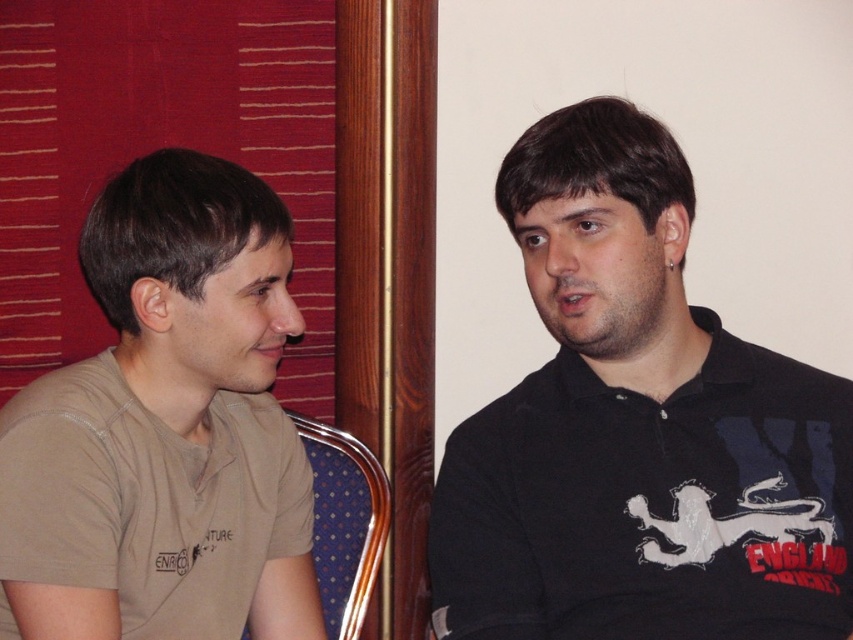
You are sitting in the blue fabric chair at left and want to hand a document to the person wearing the black matte shirt at right. Which direction should you move to reach them?

The black matte shirt at right is to the right of the blue fabric chair at left, so you should move to your right to reach them.

You are a photographer setting up a photo shoot in the scene described. You need to ensure that the black matte shirt at right and the blue fabric chair at left are both visible in the frame. Given their heights, which object should you position closer to the camera to ensure both are fully visible?

The black matte shirt at right is taller than the blue fabric chair at left. To ensure both are fully visible, position the black matte shirt at right closer to the camera so its height doesn